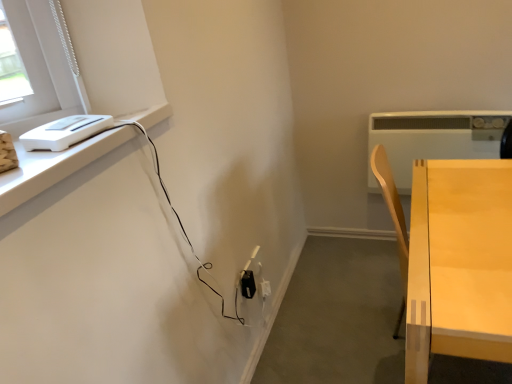
Question: In the image, is white plastic toaster at upper left, which ranks as the second appliance in right-to-left order, on the left side or the right side of black plastic electric outlet at lower center?

Choices:
 (A) right
 (B) left

Answer: (B)

Question: Is white plastic toaster at upper left, which ranks as the second appliance in right-to-left order, wider or thinner than black plastic electric outlet at lower center?

Choices:
 (A) wide
 (B) thin

Answer: (A)

Question: Which of these objects is positioned farthest from the black plastic electric outlet at lower center?

Choices:
 (A) light wood table at right
 (B) white plastic heater at upper right, the 1th appliance when ordered from right to left
 (C) white plastic toaster at upper left, which ranks as the second appliance in right-to-left order

Answer: (B)

Question: Which of these objects is positioned closest to the light wood table at right?

Choices:
 (A) black plastic electric outlet at lower center
 (B) white plastic heater at upper right, the 1th appliance when ordered from right to left
 (C) white plastic toaster at upper left, which ranks as the second appliance in right-to-left order

Answer: (B)